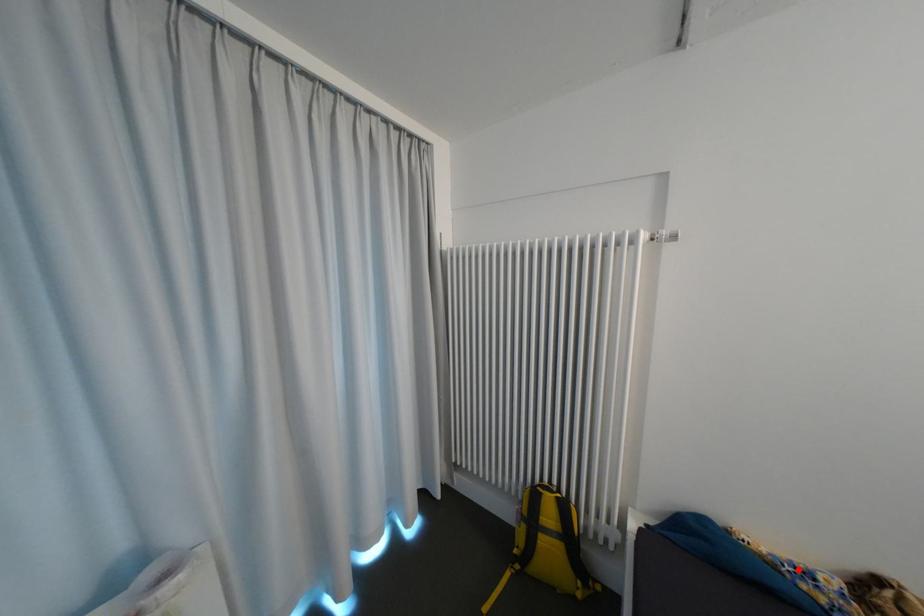
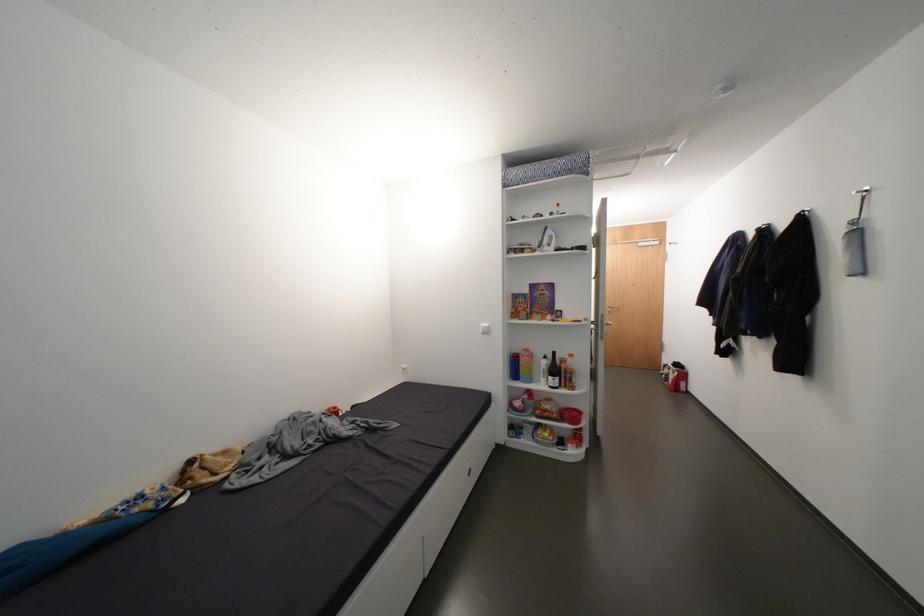
Question: I am providing you with two images of the same scene from different viewpoints. A red point is shown in image1. For the corresponding object point in image2, is it positioned nearer or farther from the camera?

Choices:
 (A) Nearer
 (B) Farther

Answer: (B)